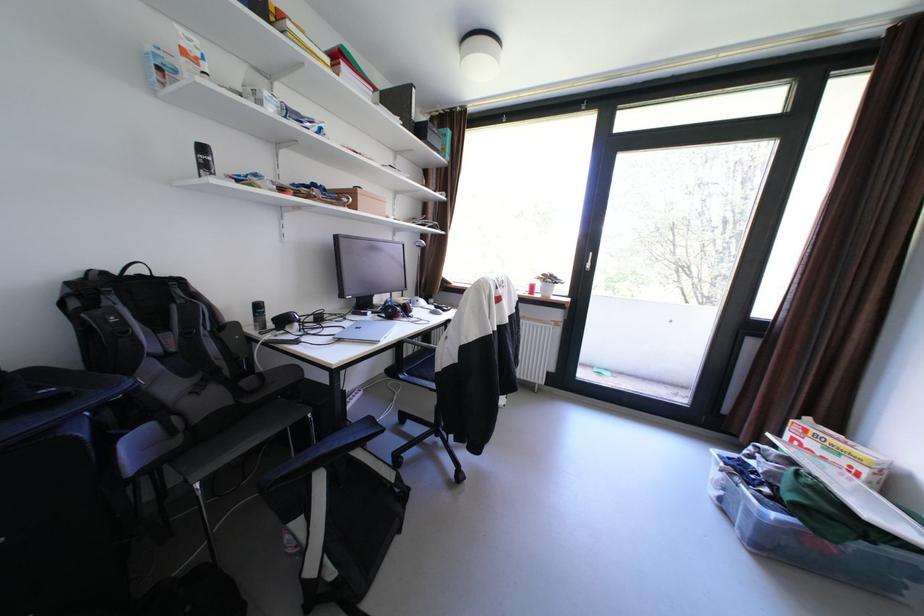
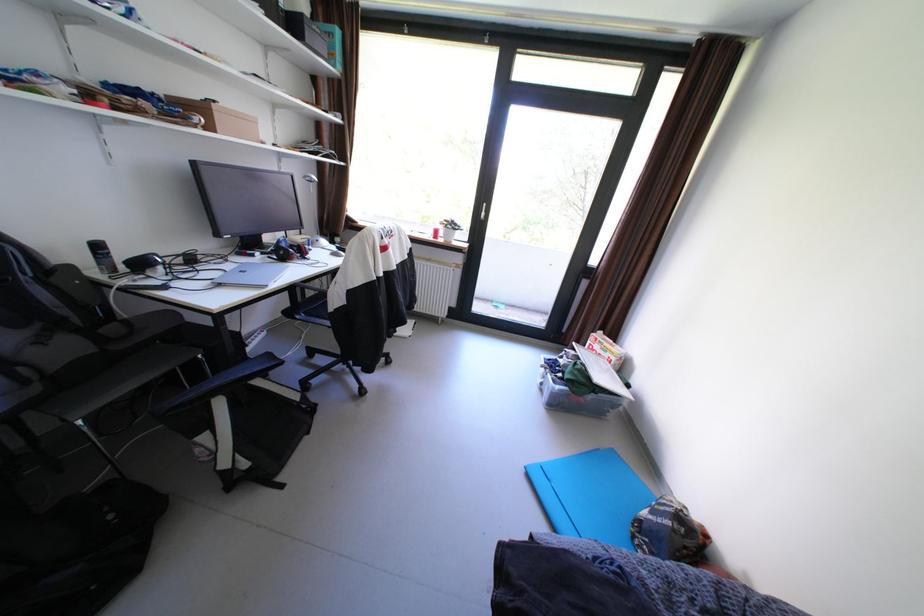
Where in the second image is the point corresponding to the point at 335,191 from the first image?

(172, 100)